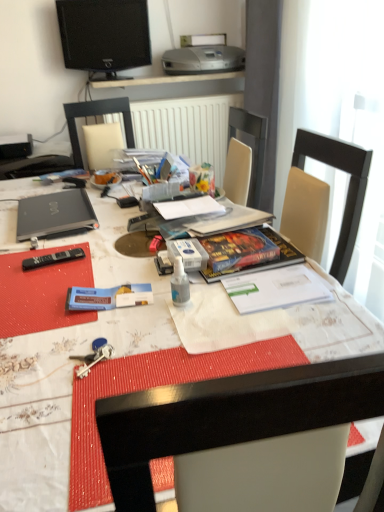
Identify the location of free space to the right of black matte laptop at left. The height and width of the screenshot is (512, 384). (117, 220).